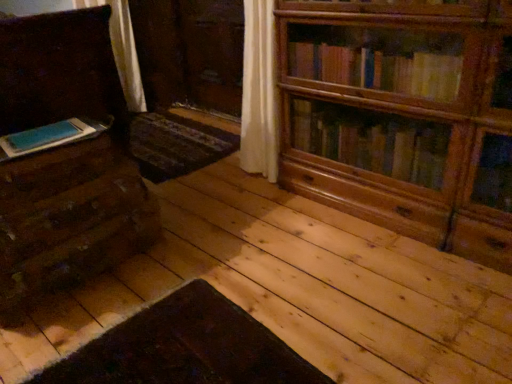
Question: Is blue matte book at left in front of or behind matte wood drawer at left in the image?

Choices:
 (A) front
 (B) behind

Answer: (B)

Question: Considering the positions of blue matte book at left and matte wood drawer at left in the image, is blue matte book at left wider or thinner than matte wood drawer at left?

Choices:
 (A) thin
 (B) wide

Answer: (A)

Question: Which object is positioned farthest from the matte wood drawer at left?

Choices:
 (A) wooden bookcase at upper right
 (B) matte brown chest of drawers at left
 (C) blue matte book at left

Answer: (A)

Question: Considering the real-world distances, which object is farthest from the matte brown chest of drawers at left?

Choices:
 (A) wooden bookcase at upper right
 (B) matte wood drawer at left
 (C) blue matte book at left

Answer: (A)